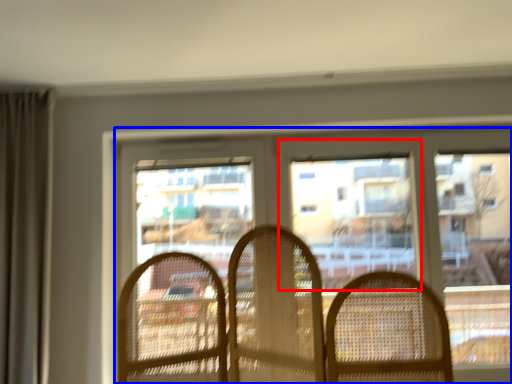
Question: Among these objects, which one is farthest to the camera, window screen (highlighted by a red box) or window (highlighted by a blue box)?

Choices:
 (A) window screen
 (B) window

Answer: (A)